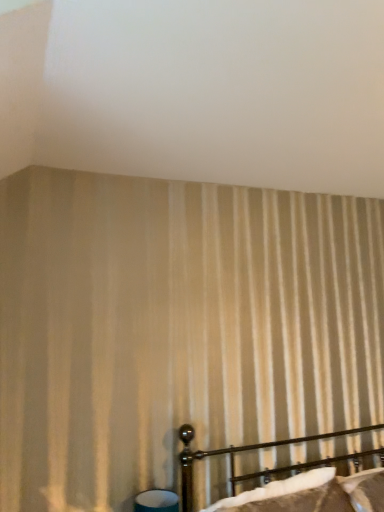
Question: Is polished dark brown bed at lower right bigger or smaller than teal fabric table lamp at lower center?

Choices:
 (A) big
 (B) small

Answer: (A)

Question: Is point (354, 428) positioned closer to the camera than point (134, 509)?

Choices:
 (A) closer
 (B) farther

Answer: (B)

Question: In terms of height, does polished dark brown bed at lower right look taller or shorter compared to teal fabric table lamp at lower center?

Choices:
 (A) tall
 (B) short

Answer: (A)

Question: From a real-world perspective, is teal fabric table lamp at lower center physically located above or below polished dark brown bed at lower right?

Choices:
 (A) below
 (B) above

Answer: (A)

Question: Considering the relative positions of teal fabric table lamp at lower center and polished dark brown bed at lower right in the image provided, is teal fabric table lamp at lower center to the left or to the right of polished dark brown bed at lower right?

Choices:
 (A) left
 (B) right

Answer: (A)

Question: Considering the positions of teal fabric table lamp at lower center and polished dark brown bed at lower right in the image, is teal fabric table lamp at lower center wider or thinner than polished dark brown bed at lower right?

Choices:
 (A) thin
 (B) wide

Answer: (A)

Question: From the image's perspective, is teal fabric table lamp at lower center above or below polished dark brown bed at lower right?

Choices:
 (A) below
 (B) above

Answer: (A)